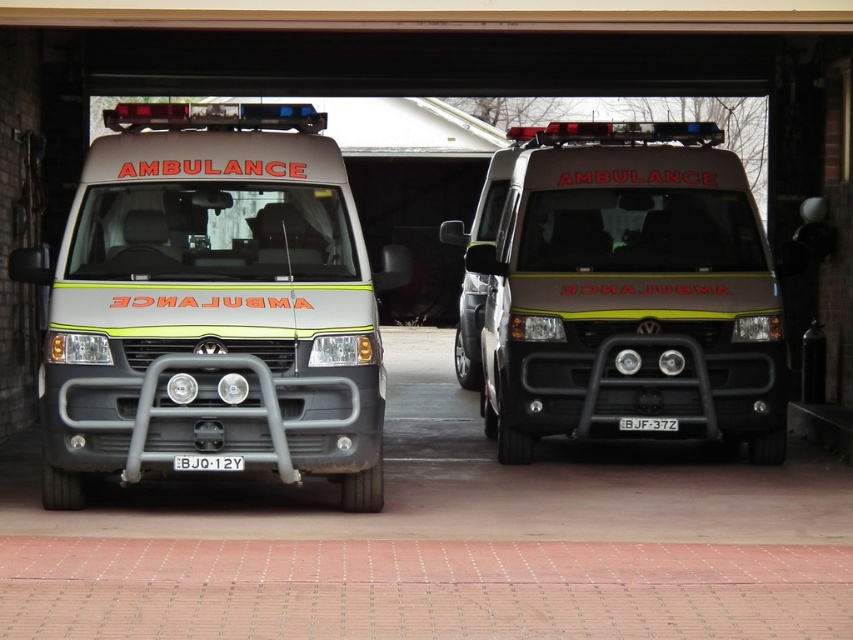
Question: Can you confirm if matte grey ambulance at center is positioned to the left of matte silver ambulance at center?

Choices:
 (A) no
 (B) yes

Answer: (B)

Question: Which of the following is the farthest from the observer?

Choices:
 (A) matte grey ambulance at center
 (B) matte silver ambulance at center

Answer: (B)

Question: Which object is farther from the camera taking this photo?

Choices:
 (A) matte grey ambulance at center
 (B) matte silver ambulance at center

Answer: (B)

Question: Is the position of matte grey ambulance at center more distant than that of matte silver ambulance at center?

Choices:
 (A) no
 (B) yes

Answer: (A)

Question: Can you confirm if matte grey ambulance at center is positioned to the left of matte silver ambulance at center?

Choices:
 (A) yes
 (B) no

Answer: (A)